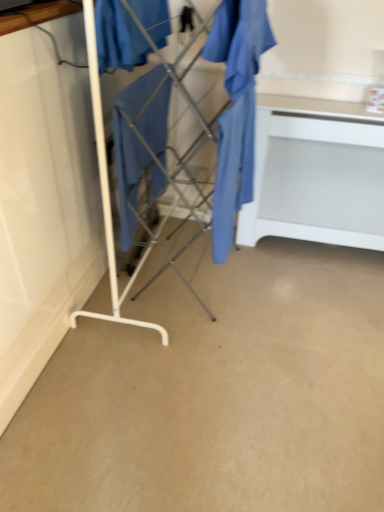
Locate an element on the screen. The image size is (384, 512). vacant space in front of white matte table at center is located at coordinates (312, 297).